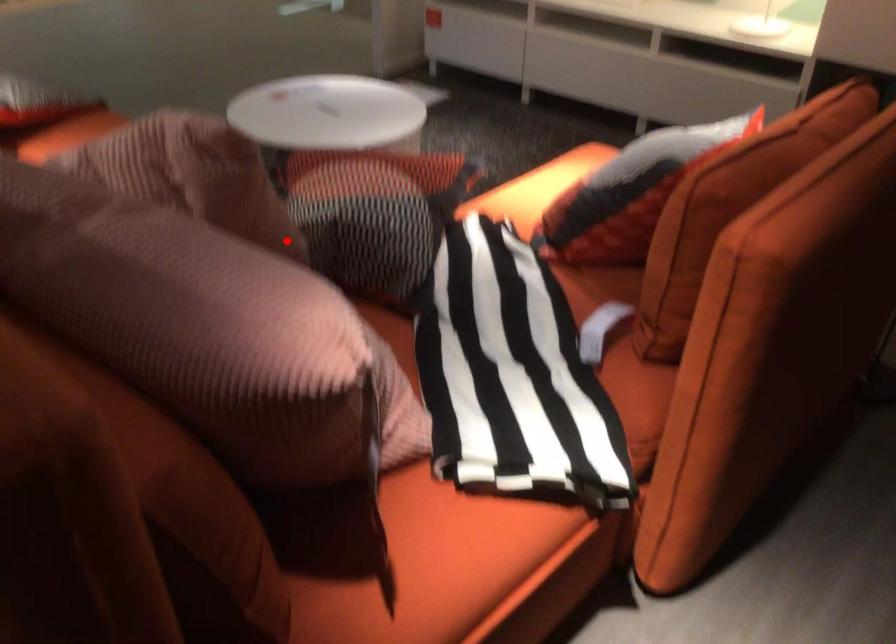
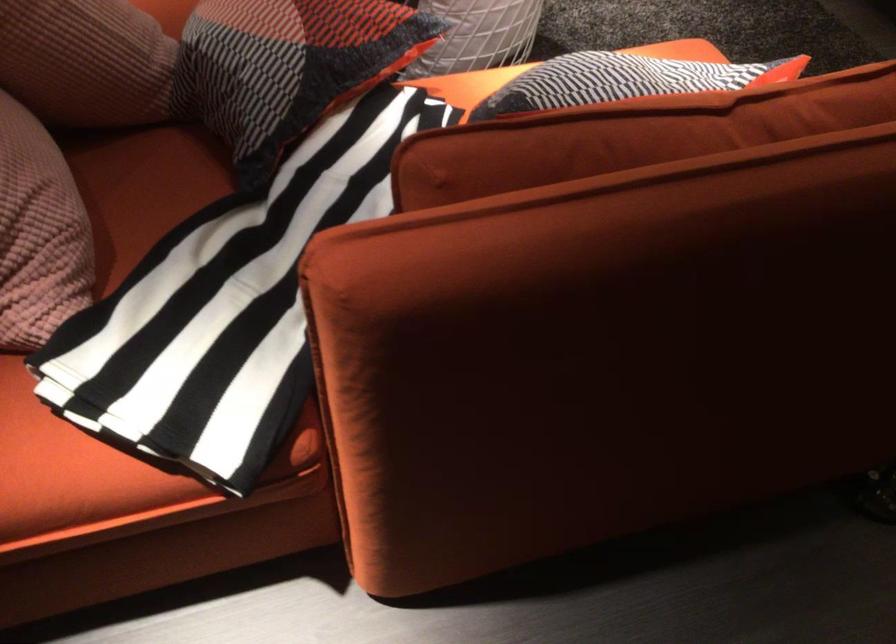
Question: A red point is marked in image1. In image2, is the corresponding 3D point closer to the camera or farther? Reply with the corresponding letter.

Choices:
 (A) The corresponding 3D point is closer.
 (B) The corresponding 3D point is farther.

Answer: (A)